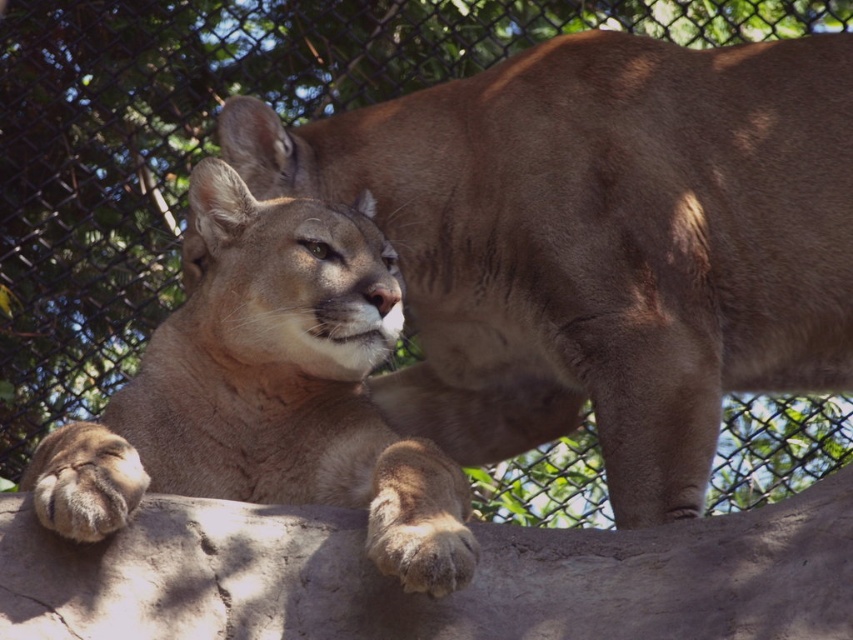
Can you confirm if gray rough stone at center is thinner than light brown fur cougar at center?

In fact, gray rough stone at center might be wider than light brown fur cougar at center.

Is gray rough stone at center shorter than light brown fur cougar at center?

Yes.

Who is more forward, (x=514, y=564) or (x=131, y=436)?

Point (x=514, y=564) is more forward.

You are a GUI agent. You are given a task and a screenshot of the screen. Output one action in this format:
    pyautogui.click(x=<x>, y=<y>)
    Task: Click on the gray rough stone at center
    Image resolution: width=853 pixels, height=640 pixels.
    Given the screenshot: What is the action you would take?
    pyautogui.click(x=424, y=595)